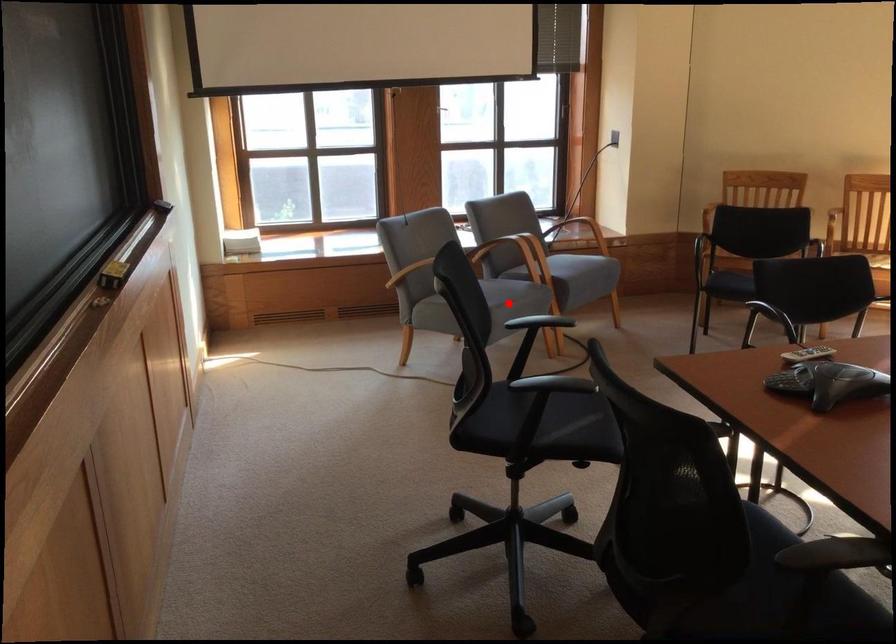
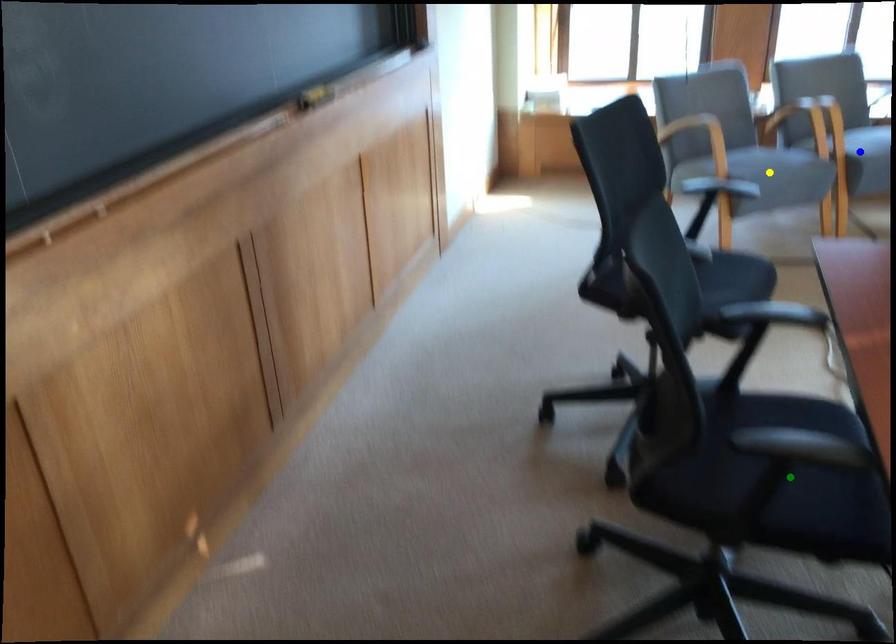
Question: I am providing you with two images of the same scene from different viewpoints. A red point is marked on the first image. You are given multiple points on the second image. Which spot in image 2 lines up with the point in image 1?

Choices:
 (A) yellow point
 (B) blue point
 (C) green point

Answer: (A)